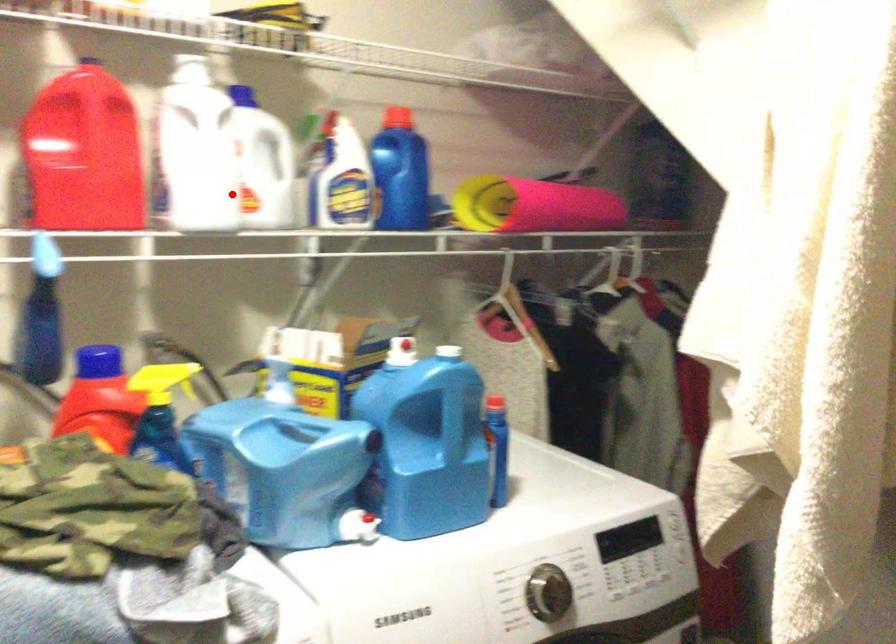
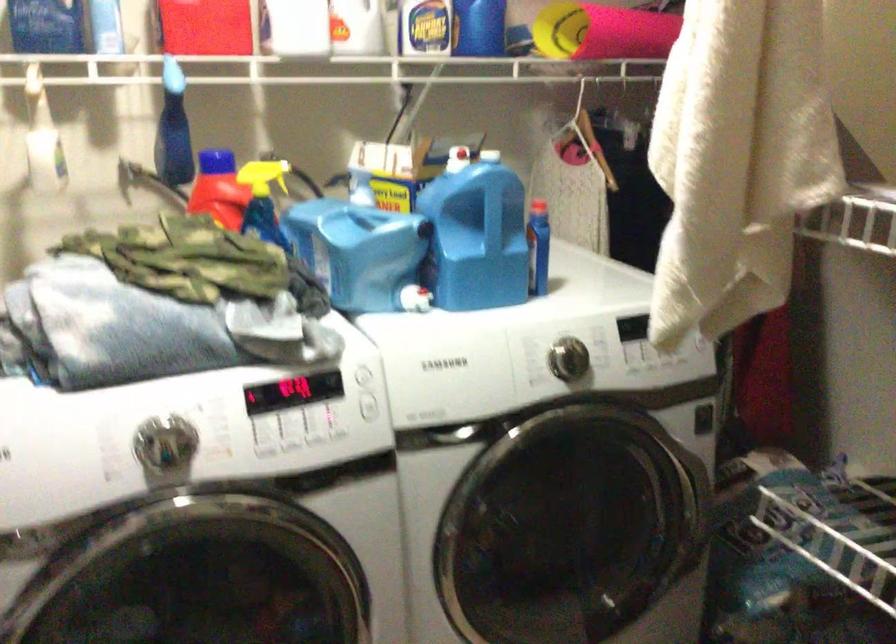
In the second image, find the point that corresponds to the highlighted location in the first image.

(323, 28)